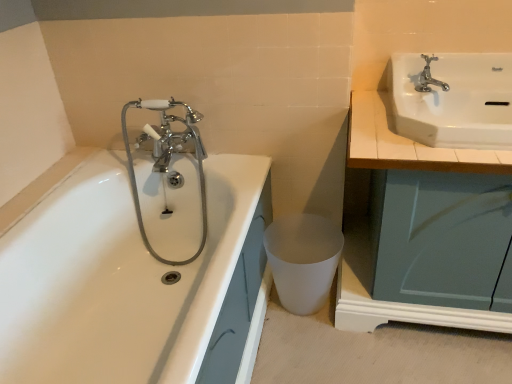
Question: Is white glossy sink at upper right positioned with its back to white matte plastic at lower center?

Choices:
 (A) no
 (B) yes

Answer: (A)

Question: From the image's perspective, is white glossy sink at upper right beneath white matte plastic at lower center?

Choices:
 (A) yes
 (B) no

Answer: (B)

Question: Considering the relative sizes of white glossy sink at upper right and white matte plastic at lower center in the image provided, is white glossy sink at upper right thinner than white matte plastic at lower center?

Choices:
 (A) yes
 (B) no

Answer: (B)

Question: Is white glossy sink at upper right smaller than white matte plastic at lower center?

Choices:
 (A) yes
 (B) no

Answer: (B)

Question: Is white glossy sink at upper right outside white matte plastic at lower center?

Choices:
 (A) no
 (B) yes

Answer: (B)

Question: Which is correct: chrome metallic faucet at upper right is inside white glossy bathtub at left, or outside of it?

Choices:
 (A) outside
 (B) inside

Answer: (A)

Question: Visually, is chrome metallic faucet at upper right positioned to the left or to the right of white glossy bathtub at left?

Choices:
 (A) right
 (B) left

Answer: (A)

Question: Based on their sizes in the image, would you say chrome metallic faucet at upper right is bigger or smaller than white glossy bathtub at left?

Choices:
 (A) small
 (B) big

Answer: (A)

Question: From the image's perspective, relative to white glossy bathtub at left, is chrome metallic faucet at upper right above or below?

Choices:
 (A) below
 (B) above

Answer: (B)

Question: From the image's perspective, is white glossy sink at upper right positioned above or below white glossy bathtub at left?

Choices:
 (A) below
 (B) above

Answer: (B)

Question: Considering the positions of point (413, 96) and point (75, 309), is point (413, 96) closer or farther from the camera than point (75, 309)?

Choices:
 (A) closer
 (B) farther

Answer: (A)

Question: In terms of width, does white glossy sink at upper right look wider or thinner when compared to white glossy bathtub at left?

Choices:
 (A) thin
 (B) wide

Answer: (A)

Question: Do you think white glossy sink at upper right is within white glossy bathtub at left, or outside of it?

Choices:
 (A) inside
 (B) outside

Answer: (B)

Question: Is chrome/metallic faucet at left bigger or smaller than white wood countertop at upper right?

Choices:
 (A) big
 (B) small

Answer: (B)

Question: Is chrome/metallic faucet at left situated inside white wood countertop at upper right or outside?

Choices:
 (A) outside
 (B) inside

Answer: (A)